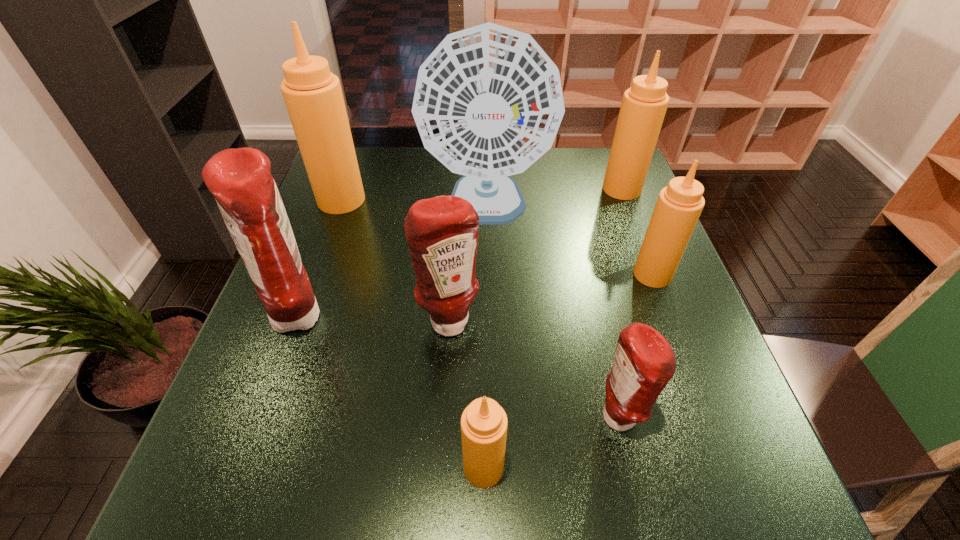
The height and width of the screenshot is (540, 960). Find the location of `fan`. fan is located at coordinates (488, 102).

The image size is (960, 540). What are the coordinates of `the tallest condiment` in the screenshot? It's located at (313, 96).

At what (x,y) coordinates should I click in order to perform the action: click on the biggest tan condiment. Please return your answer as a coordinate pair (x, y). Looking at the image, I should click on click(x=313, y=96).

At what (x,y) coordinates should I click in order to perform the action: click on the third smallest tan condiment. Please return your answer as a coordinate pair (x, y). Image resolution: width=960 pixels, height=540 pixels. Looking at the image, I should click on (644, 104).

Where is `the leftmost red condiment`? This screenshot has height=540, width=960. the leftmost red condiment is located at coordinates (240, 179).

Image resolution: width=960 pixels, height=540 pixels. I want to click on the second red condiment from right to left, so click(x=442, y=232).

Find the location of a particular element. the third farthest tan condiment is located at coordinates (679, 205).

This screenshot has height=540, width=960. Find the location of `the third biggest tan condiment`. the third biggest tan condiment is located at coordinates (679, 205).

This screenshot has height=540, width=960. I want to click on the third object from right to left, so click(644, 362).

The height and width of the screenshot is (540, 960). I want to click on the rightmost red condiment, so click(644, 362).